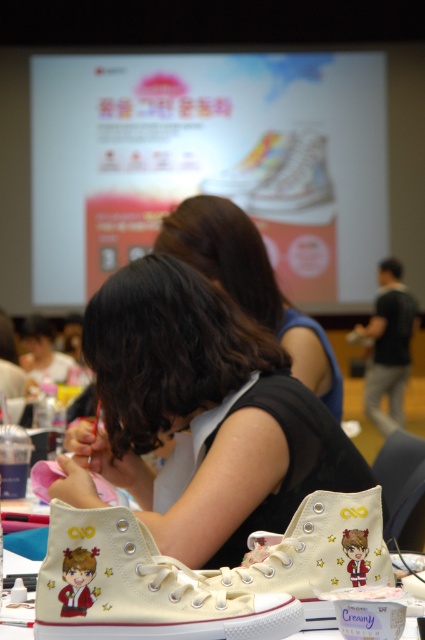
Does white canvas shoe at center have a larger size compared to white matte shoe at center?

Actually, white canvas shoe at center might be smaller than white matte shoe at center.

Does white canvas shoe at center have a lesser width compared to white matte shoe at center?

Yes.

At what (x,y) coordinates should I click in order to perform the action: click on white canvas shoe at center. Please return your answer as a coordinate pair (x, y). The image size is (425, 640). Looking at the image, I should click on (316, 554).

Can you confirm if matte black hair at center is smaller than beige canvas shoes at lower center?

Actually, matte black hair at center might be larger than beige canvas shoes at lower center.

Is matte black hair at center closer to the viewer compared to beige canvas shoes at lower center?

No.

Between point (283, 344) and point (28, 637), which one is positioned in front?

Point (28, 637) is more forward.

Image resolution: width=425 pixels, height=640 pixels. I want to click on matte black hair at center, so click(x=251, y=284).

Between point (161, 429) and point (325, 604), which one is positioned in front?

Positioned in front is point (325, 604).

Between matte white sneakers at lower center and white canvas shoe at center, which one appears on the right side from the viewer's perspective?

white canvas shoe at center

Between point (183, 467) and point (282, 579), which one is positioned behind?

The point (183, 467) is more distant.

Locate an element on the screen. The width and height of the screenshot is (425, 640). matte white sneakers at lower center is located at coordinates (201, 416).